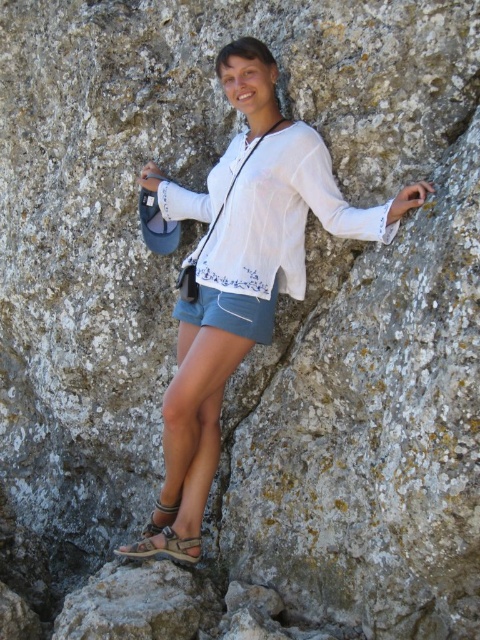
Question: Can you confirm if white sheer blouse at center is thinner than denim shorts at center?

Choices:
 (A) yes
 (B) no

Answer: (B)

Question: Does denim shorts at center come in front of brown leather sandal at lower center?

Choices:
 (A) yes
 (B) no

Answer: (A)

Question: Which of the following is the closest to the observer?

Choices:
 (A) brown leather sandal at lower center
 (B) matte white blouse at center

Answer: (B)

Question: Which object is positioned farthest from the brown fabric sandal at lower center?

Choices:
 (A) brown leather sandal at lower center
 (B) denim shorts at center
 (C) white sheer blouse at center
 (D) matte white blouse at center

Answer: (D)

Question: Which point is farther to the camera?

Choices:
 (A) (159, 552)
 (B) (276, 74)

Answer: (B)

Question: Does white sheer blouse at center appear on the left side of brown leather sandal at lower center?

Choices:
 (A) no
 (B) yes

Answer: (A)